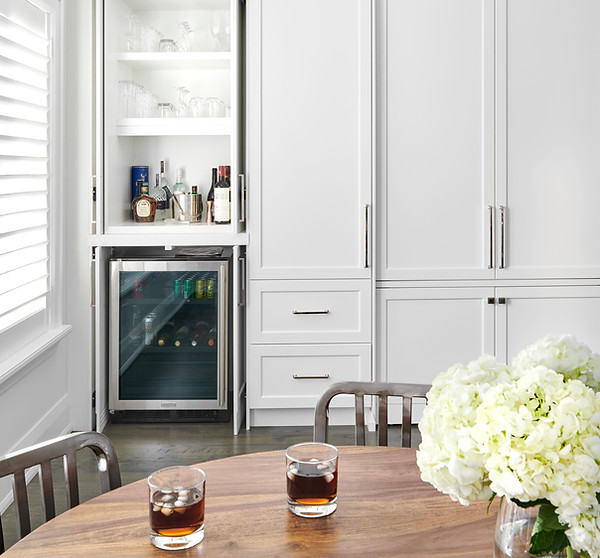
What are the coordinates of `fridge` in the screenshot? It's located at (160, 371).